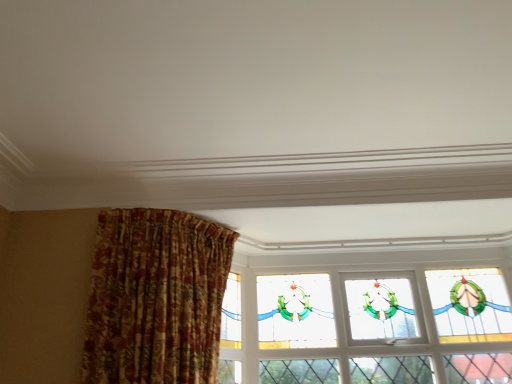
Locate an element on the screen. The image size is (512, 384). stained glass window at upper center is located at coordinates (367, 328).

Describe the element at coordinates (367, 328) in the screenshot. This screenshot has height=384, width=512. I see `stained glass window at upper center` at that location.

Measure the distance between floral fabric curtain at left and camera.

floral fabric curtain at left and camera are 5.98 feet apart.

Describe the element at coordinates (156, 298) in the screenshot. I see `floral fabric curtain at left` at that location.

This screenshot has height=384, width=512. Find the location of `floral fabric curtain at left`. floral fabric curtain at left is located at coordinates (156, 298).

This screenshot has height=384, width=512. Identify the location of stained glass window at upper center. (367, 328).

Can you confirm if stained glass window at upper center is positioned to the left of floral fabric curtain at left?

No, stained glass window at upper center is not to the left of floral fabric curtain at left.

Is stained glass window at upper center in front of or behind floral fabric curtain at left in the image?

Clearly, stained glass window at upper center is behind floral fabric curtain at left.

Considering the positions of point (342, 354) and point (200, 279), is point (342, 354) closer or farther from the camera than point (200, 279)?

Point (342, 354) is farther from the camera than point (200, 279).

From the image's perspective, which is below, stained glass window at upper center or floral fabric curtain at left?

From the image's view, stained glass window at upper center is below.

From a real-world perspective, is stained glass window at upper center over floral fabric curtain at left?

Yes, from a real-world perspective, stained glass window at upper center is above floral fabric curtain at left.

Which object is wider, stained glass window at upper center or floral fabric curtain at left?

With larger width is floral fabric curtain at left.

Does stained glass window at upper center have a greater height compared to floral fabric curtain at left?

Indeed, stained glass window at upper center has a greater height compared to floral fabric curtain at left.

Does stained glass window at upper center have a larger size compared to floral fabric curtain at left?

No.

Is floral fabric curtain at left inside stained glass window at upper center?

No, floral fabric curtain at left is located outside of stained glass window at upper center.

Would you consider stained glass window at upper center to be distant from floral fabric curtain at left?

No, stained glass window at upper center is not far away from floral fabric curtain at left.

Does stained glass window at upper center turn towards floral fabric curtain at left?

Yes, stained glass window at upper center is facing floral fabric curtain at left.

Can you tell me how much stained glass window at upper center and floral fabric curtain at left differ in facing direction?

The angle between the facing direction of stained glass window at upper center and the facing direction of floral fabric curtain at left is 33.2 degrees.

How distant is stained glass window at upper center from floral fabric curtain at left?

They are 34.54 inches apart.

The height and width of the screenshot is (384, 512). What are the coordinates of `curtain located above the stained glass window at upper center (from the image's perspective)` in the screenshot? It's located at (156, 298).

Which object is positioned more to the right, floral fabric curtain at left or stained glass window at upper center?

stained glass window at upper center is more to the right.

Which object is further away from the camera, floral fabric curtain at left or stained glass window at upper center?

stained glass window at upper center is behind.

Does point (137, 303) come farther from viewer compared to point (248, 359)?

No, it is not.

From the image's perspective, which one is positioned higher, floral fabric curtain at left or stained glass window at upper center?

floral fabric curtain at left.

From a real-world perspective, which is physically above, floral fabric curtain at left or stained glass window at upper center?

In real-world perspective, stained glass window at upper center is above.

Does floral fabric curtain at left have a greater width compared to stained glass window at upper center?

Indeed, floral fabric curtain at left has a greater width compared to stained glass window at upper center.

Is floral fabric curtain at left taller than stained glass window at upper center?

Incorrect, the height of floral fabric curtain at left is not larger of that of stained glass window at upper center.

Considering the sizes of objects floral fabric curtain at left and stained glass window at upper center in the image provided, who is smaller, floral fabric curtain at left or stained glass window at upper center?

stained glass window at upper center is smaller.

Which is correct: floral fabric curtain at left is inside stained glass window at upper center, or outside of it?

The correct answer is: outside.

Is the surface of floral fabric curtain at left in direct contact with stained glass window at upper center?

There is a gap between floral fabric curtain at left and stained glass window at upper center.

In the scene shown: Does floral fabric curtain at left turn towards stained glass window at upper center?

No.

The image size is (512, 384). I want to click on window above the floral fabric curtain at left (from a real-world perspective), so click(x=367, y=328).

The image size is (512, 384). Identify the location of window that appears on the right of floral fabric curtain at left. (367, 328).

You are a GUI agent. You are given a task and a screenshot of the screen. Output one action in this format:
    pyautogui.click(x=<x>, y=<y>)
    Task: Click on the window lying behind the floral fabric curtain at left
    This screenshot has height=384, width=512.
    Given the screenshot: What is the action you would take?
    pyautogui.click(x=367, y=328)